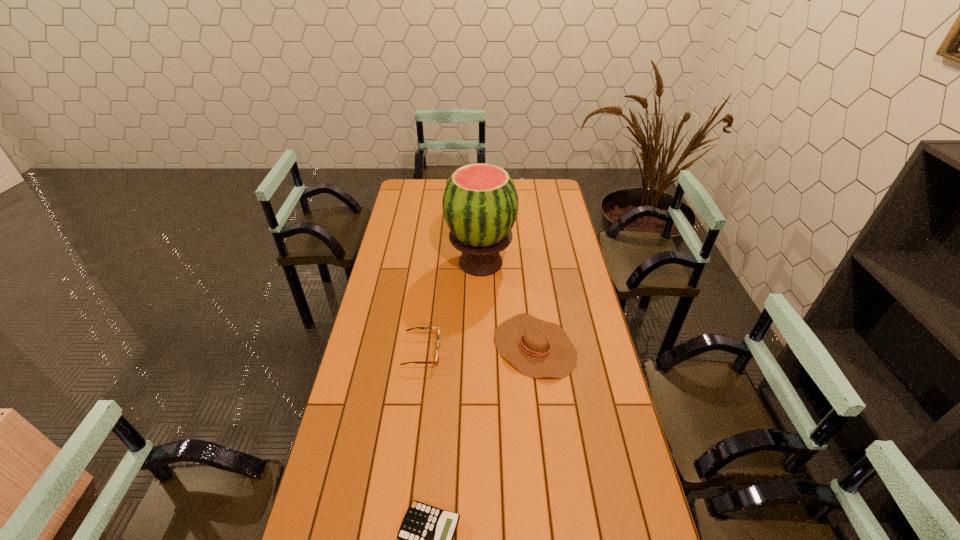
The image size is (960, 540). Identify the location of vacant space at the right edge. (626, 476).

You are a GUI agent. You are given a task and a screenshot of the screen. Output one action in this format:
    pyautogui.click(x=<x>, y=<y>)
    Task: Click on the vacant space at the far left corner of the desktop
    
    Given the screenshot: What is the action you would take?
    pyautogui.click(x=424, y=181)

The image size is (960, 540). What are the coordinates of `vacant area at the far right corner` in the screenshot? It's located at (544, 190).

Locate an element on the screen. This screenshot has height=540, width=960. empty space that is in between the cowboy hat and the spectacles is located at coordinates (478, 349).

Locate an element on the screen. free spot between the spectacles and the tallest object is located at coordinates 451,307.

Find the location of `empty location between the cowboy hat and the spectacles`. empty location between the cowboy hat and the spectacles is located at coordinates (478, 349).

Locate an element on the screen. The width and height of the screenshot is (960, 540). free space between the spectacles and the cowboy hat is located at coordinates (478, 349).

Where is `object that stands as the third closest to the spectacles`? The height and width of the screenshot is (540, 960). object that stands as the third closest to the spectacles is located at coordinates (425, 538).

Where is `object that is the second closest to the tallest object`? Image resolution: width=960 pixels, height=540 pixels. object that is the second closest to the tallest object is located at coordinates (438, 344).

Locate an element on the screen. vacant area in the image that satisfies the following two spatial constraints: 1. on the front side of the farthest object; 2. on the frame of the spectacles is located at coordinates (481, 352).